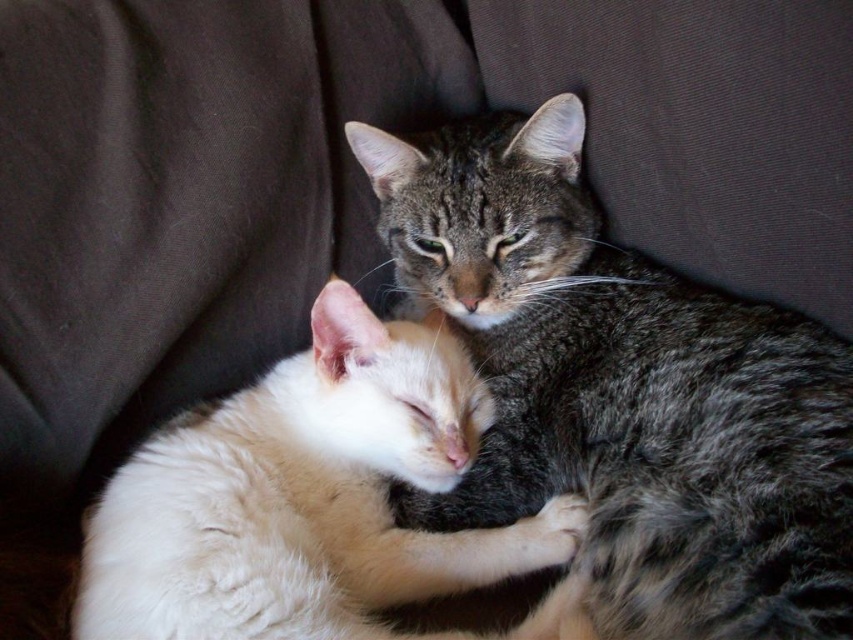
Question: Does gray tabby cat at center appear over fluffy white cat at center?

Choices:
 (A) no
 (B) yes

Answer: (B)

Question: From the image, what is the correct spatial relationship of gray tabby cat at center in relation to fluffy white cat at center?

Choices:
 (A) above
 (B) below

Answer: (A)

Question: Does gray tabby cat at center have a larger size compared to fluffy white cat at center?

Choices:
 (A) no
 (B) yes

Answer: (B)

Question: Which point appears farthest from the camera in this image?

Choices:
 (A) (386, 436)
 (B) (569, 401)

Answer: (B)

Question: Which point appears farthest from the camera in this image?

Choices:
 (A) (143, 477)
 (B) (618, 609)

Answer: (A)